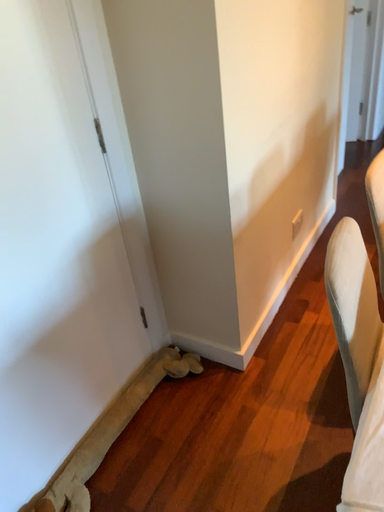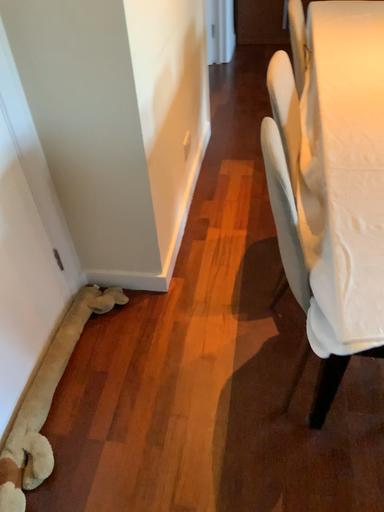
Question: Which way did the camera rotate in the video?

Choices:
 (A) rotated right
 (B) rotated left

Answer: (A)